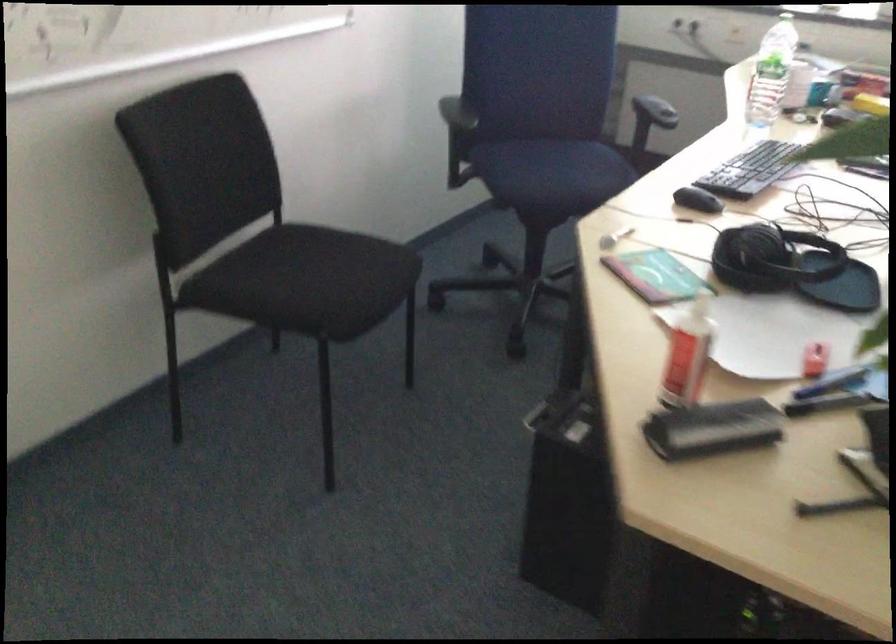
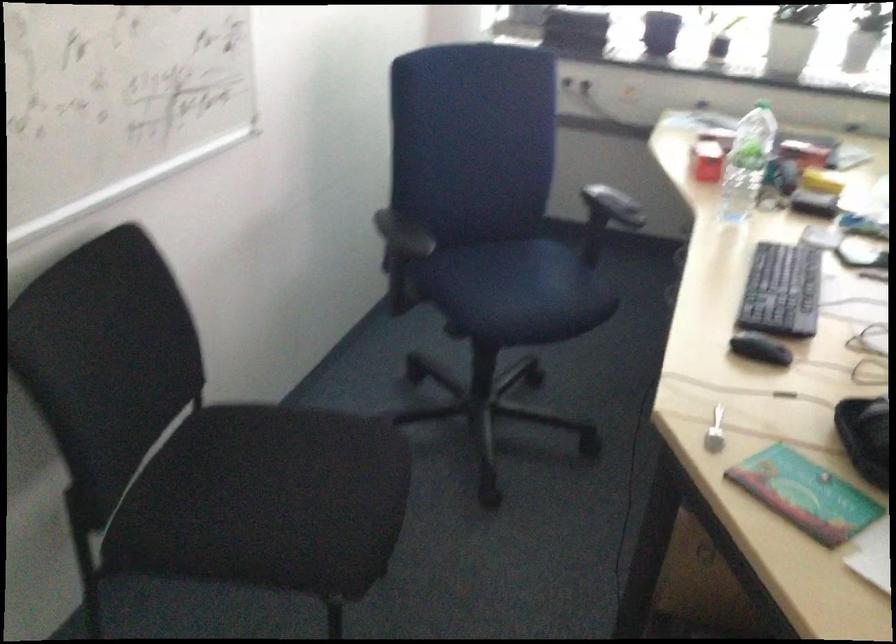
Question: The first image is from the beginning of the video and the second image is from the end. How did the camera likely rotate when shooting the video?

Choices:
 (A) Left
 (B) Right
 (C) Up
 (D) Down

Answer: (B)